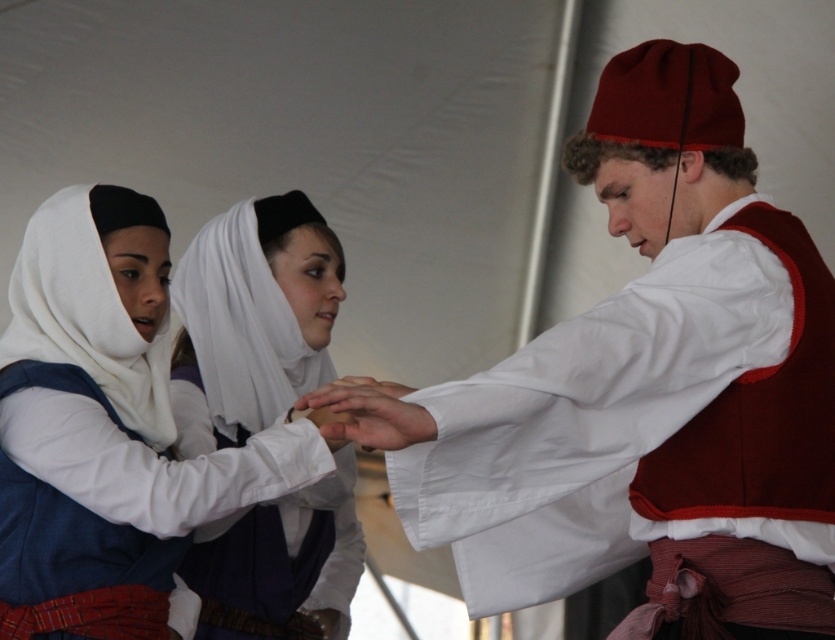
Looking at this image, in the image of the cultural performance under a white tent, there is a matte red hat at center. Where exactly is it located in terms of coordinates?

The matte red hat at center is located at coordinates point (x=655, y=392).

What is the color of the hat located at the coordinates point (655, 392)?

The hat at point (655, 392) is matte red.

You are an event organizer setting up a photo shoot under the white tent. You need to position a matte red hat at center and a white smooth hand at center so that the hand can comfortably touch the hat. Based on their sizes, is this possible?

The matte red hat at center might be wider than white smooth hand at center, so the hand can comfortably touch the hat as the hat provides enough space for the hand to reach.